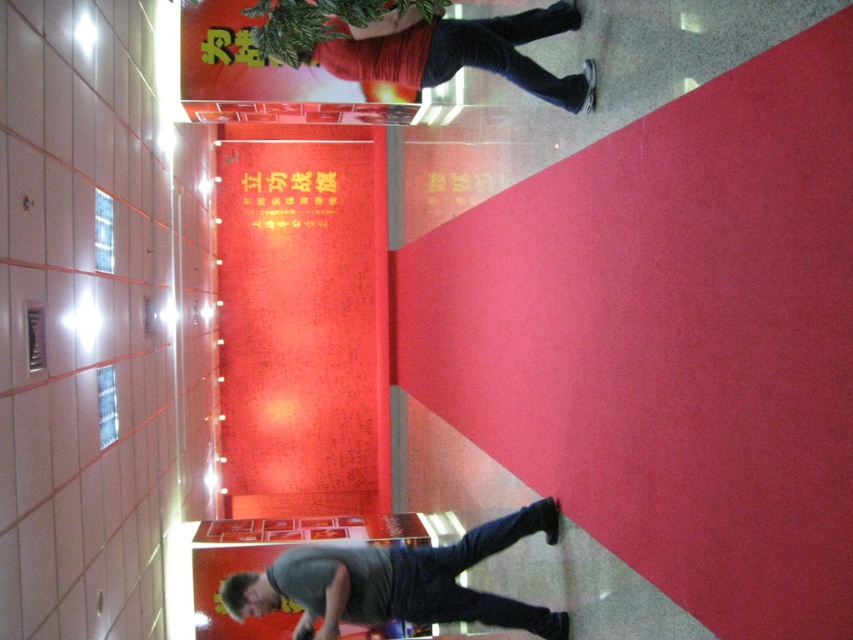
You are standing in the hallway and want to know if the matte black pants at upper right can be seen from the bottom of the red paper sign at upper center. Based on their heights, can you determine this?

The matte black pants at upper right is not as tall as red paper sign at upper center, so yes, the matte black pants at upper right can be seen from the bottom of the red paper sign at upper center since it is shorter.